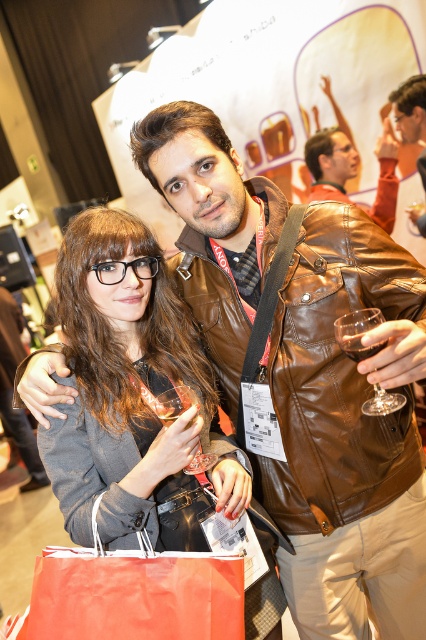
Question: Where is brown leather jacket at upper center located in relation to clear glass wine glass at lower left in the image?

Choices:
 (A) right
 (B) left

Answer: (A)

Question: Does orange paper bag at lower left have a lesser width compared to transparent glass at right?

Choices:
 (A) no
 (B) yes

Answer: (A)

Question: Estimate the real-world distances between objects in this image. Which object is closer to the orange paper bag at lower left?

Choices:
 (A) transparent glass at right
 (B) brown leather jacket at upper center

Answer: (A)

Question: Can you confirm if orange paper bag at lower left is positioned below clear glass wine glass at lower left?

Choices:
 (A) no
 (B) yes

Answer: (B)

Question: Among these objects, which one is farthest from the camera?

Choices:
 (A) orange paper bag at lower left
 (B) transparent glass at right

Answer: (A)

Question: Which point is farther from the camera taking this photo?

Choices:
 (A) (388, 168)
 (B) (337, 333)
 (C) (129, 596)

Answer: (A)